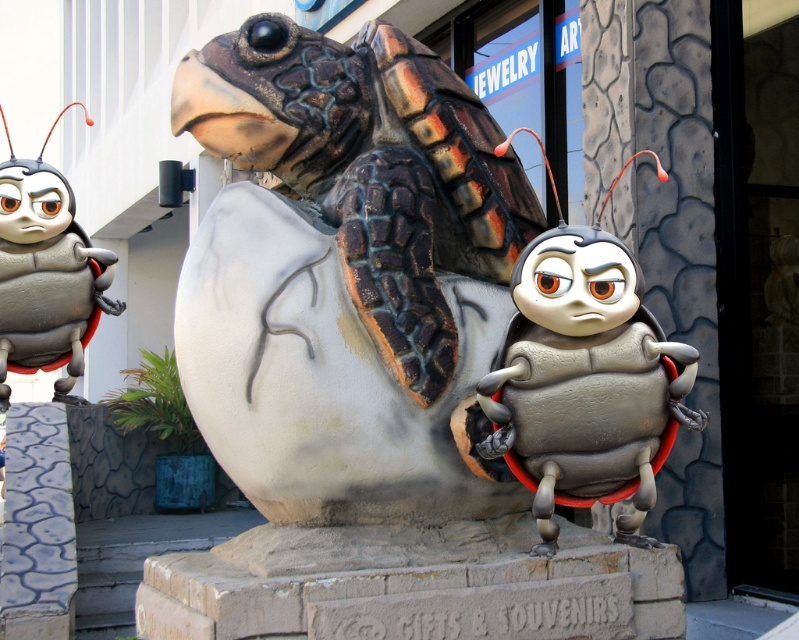
Question: Which is nearer to the brushed metal bug at left?

Choices:
 (A) matte painted tortoise at center
 (B) metallic gray beetle at center

Answer: (A)

Question: Does metallic gray beetle at center have a smaller size compared to brushed metal bug at left?

Choices:
 (A) yes
 (B) no

Answer: (B)

Question: Is metallic gray beetle at center below brushed metal bug at left?

Choices:
 (A) yes
 (B) no

Answer: (A)

Question: Which object is positioned closest to the matte painted tortoise at center?

Choices:
 (A) brushed metal bug at left
 (B) metallic gray beetle at center

Answer: (B)

Question: Considering the real-world distances, which object is closest to the matte painted tortoise at center?

Choices:
 (A) brushed metal bug at left
 (B) metallic gray beetle at center

Answer: (B)

Question: Can you confirm if matte painted tortoise at center is thinner than brushed metal bug at left?

Choices:
 (A) yes
 (B) no

Answer: (B)